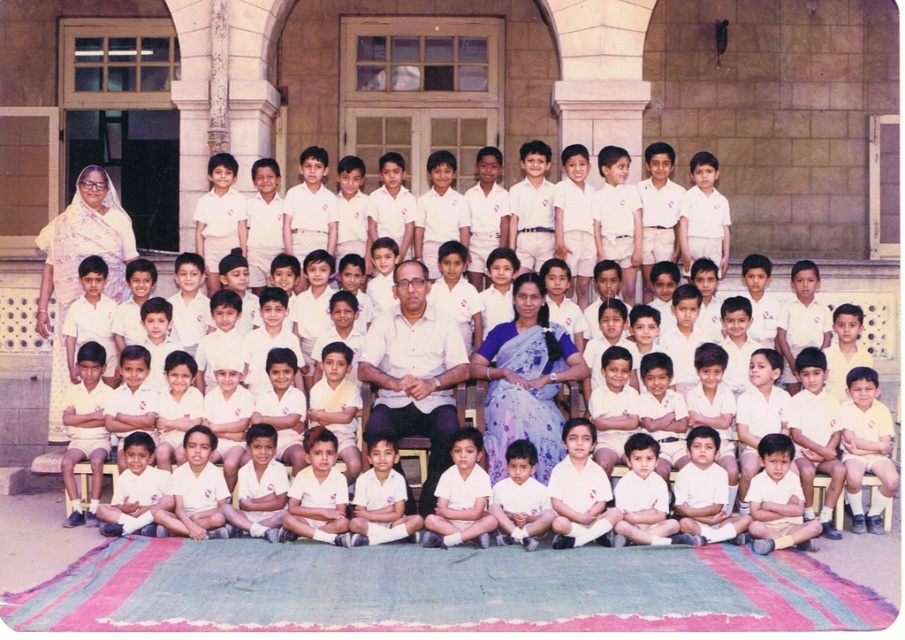
You are a photographer trying to adjust the lighting for a group photo. You notice the white printed saree at upper left and the white cotton shirt at center. Which of these two items might require more careful lighting adjustments due to its smaller size?

The white printed saree at upper left has a lesser width compared to the white cotton shirt at center, so it might require more careful lighting adjustments due to its smaller size.

You are a photographer trying to adjust the lighting for a group photo. You notice two white shirts at the center of the image. Which one is lower in position between the white matte shirt at center and the white cotton shirt at center?

The white matte shirt at center is positioned under the white cotton shirt at center, so it is lower in position.